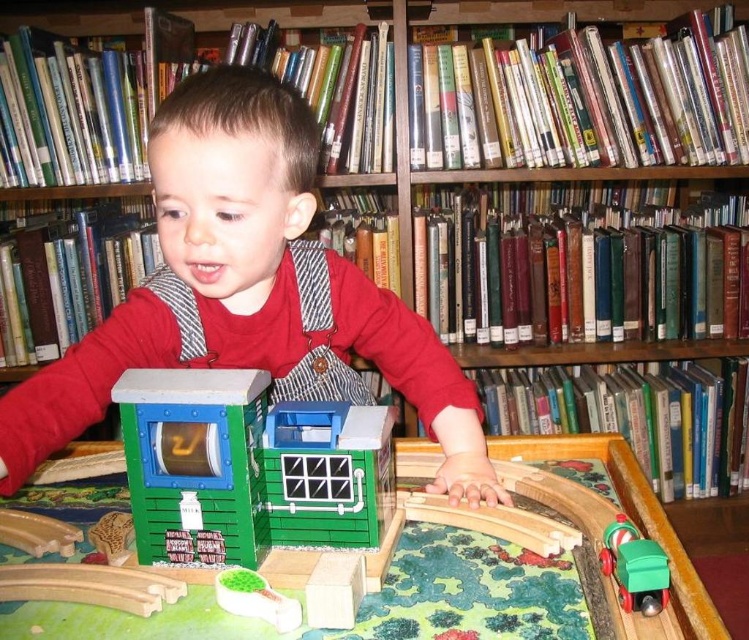
You are a parent trying to place a new toy box on the table. The toy box is 24 inches wide. Can the green plastic building at center be moved to make space for it?

The green plastic building at center is 22.15 inches away from the viewer, so moving it could provide enough space for the 24 inch wide toy box.

You are a parent trying to place a new toy car between the green plastic building at center and the green plastic train at lower right. Can you fit the toy car in the space between them if the toy car requires 10 inches of space?

The green plastic building at center is 12.12 inches from the green plastic train at lower right. Since the toy car needs 10 inches of space, there is enough room to place it between them.

Looking at this image, what object is located at the coordinates point (248, 468) in the image?

The green plastic building at center is located at point (248, 468).